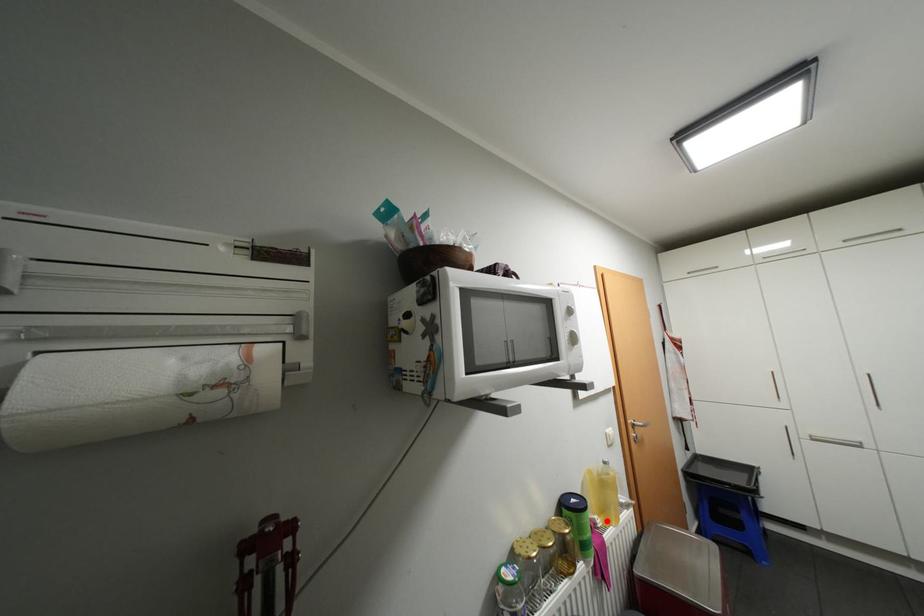
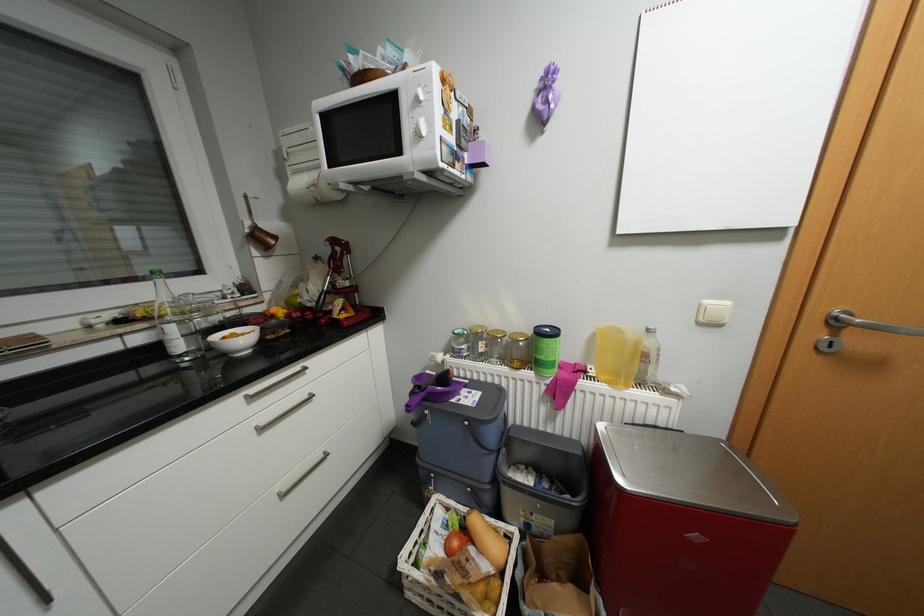
Question: I am providing you with two images of the same scene from different viewpoints. Given a red point in image1, look at the same physical point in image2. Is it:

Choices:
 (A) Closer to the viewpoint
 (B) Farther from the viewpoint

Answer: (A)